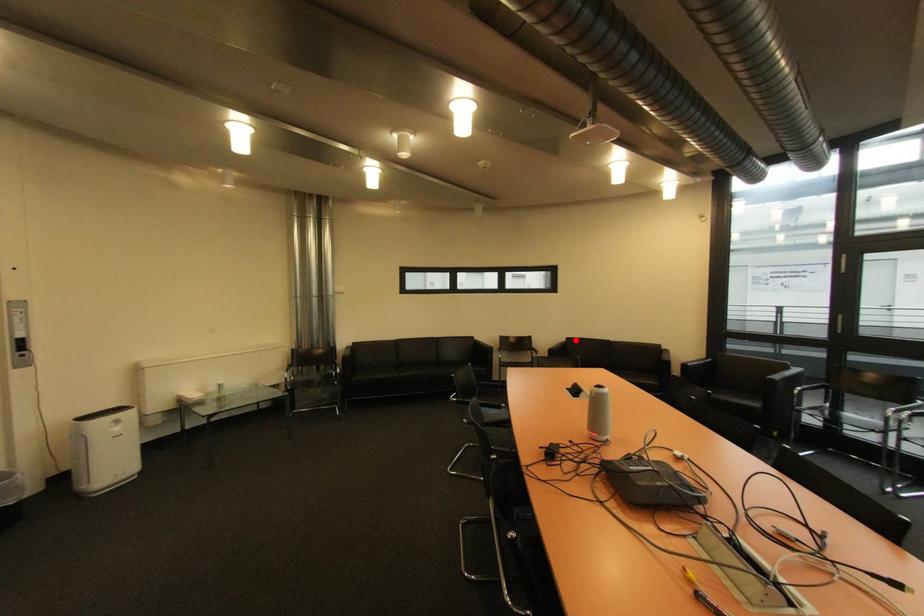
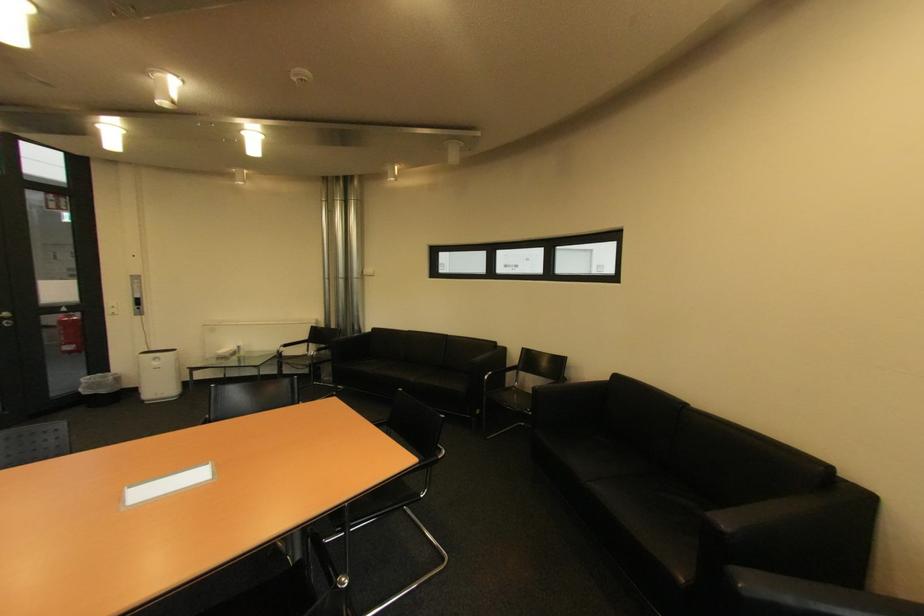
Locate, in the second image, the point that corresponds to the highlighted location in the first image.

(625, 378)